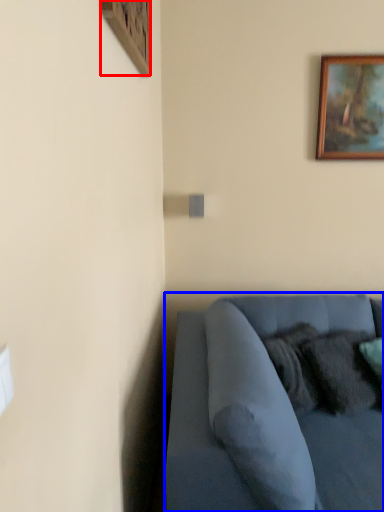
Question: Which object is closer to the camera taking this photo, picture frame (highlighted by a red box) or studio couch (highlighted by a blue box)?

Choices:
 (A) picture frame
 (B) studio couch

Answer: (B)